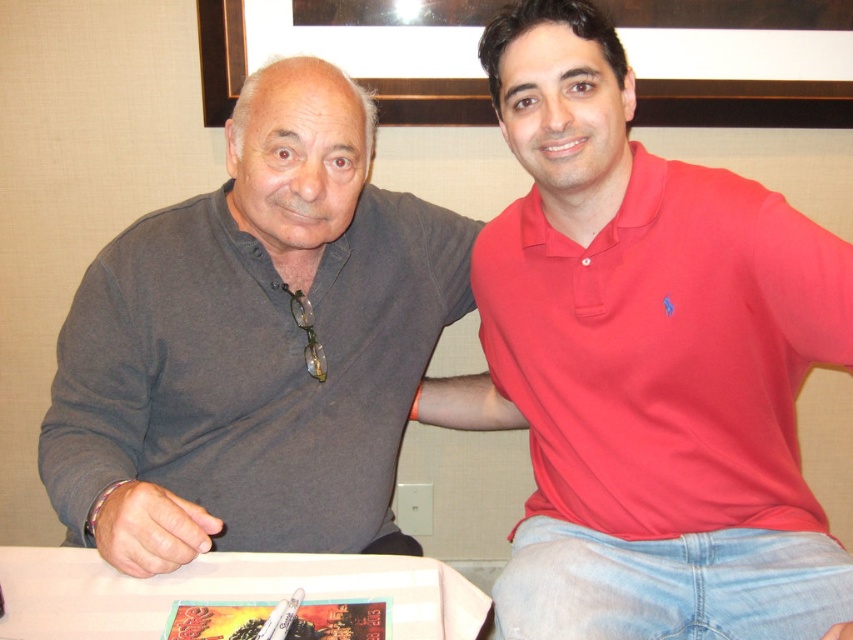
Which is above, red cotton polo shirt at center or matte gray sweater at left?

matte gray sweater at left

The image size is (853, 640). Describe the element at coordinates (646, 364) in the screenshot. I see `red cotton polo shirt at center` at that location.

Where is `red cotton polo shirt at center`? This screenshot has height=640, width=853. red cotton polo shirt at center is located at coordinates (646, 364).

Can you confirm if wooden picture frame at upper center is wider than white paper at center?

Incorrect, wooden picture frame at upper center's width does not surpass white paper at center's.

Which is more to the right, wooden picture frame at upper center or white paper at center?

wooden picture frame at upper center

Find the location of a particular element. wooden picture frame at upper center is located at coordinates (738, 60).

Can you confirm if matte gray sweater at left is positioned above wooden picture frame at upper center?

No.

Does point (351, 392) come in front of point (700, 49)?

Yes.

Describe the element at coordinates (253, 346) in the screenshot. I see `matte gray sweater at left` at that location.

The width and height of the screenshot is (853, 640). I want to click on matte gray sweater at left, so click(x=253, y=346).